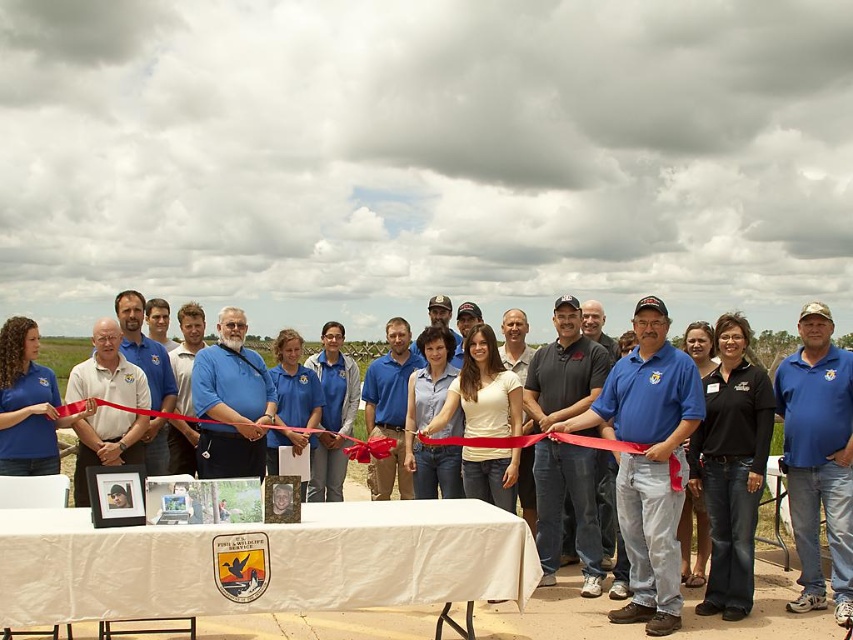
Based on the photo, is blue shirt at center taller than blue cotton shirt at center?

No, blue shirt at center is not taller than blue cotton shirt at center.

Does blue shirt at center appear on the left side of blue cotton shirt at center?

Correct, you'll find blue shirt at center to the left of blue cotton shirt at center.

Is point (508, 620) farther from viewer compared to point (825, 452)?

No, it is in front of (825, 452).

Find the location of a particular element. This screenshot has height=640, width=853. blue shirt at center is located at coordinates (379, 568).

Who is more forward, (843, 588) or (294, 440)?

Point (843, 588)

Can you confirm if blue cotton shirt at center is shorter than matte blue shirt at center?

No, blue cotton shirt at center is not shorter than matte blue shirt at center.

Which is in front, point (845, 404) or point (305, 385)?

Point (845, 404) is more forward.

Locate an element on the screen. This screenshot has width=853, height=640. blue cotton shirt at center is located at coordinates (817, 458).

Is point (838, 534) positioned before point (766, 376)?

Yes, it is.

Locate an element on the screen. The image size is (853, 640). blue cotton shirt at center is located at coordinates (817, 458).